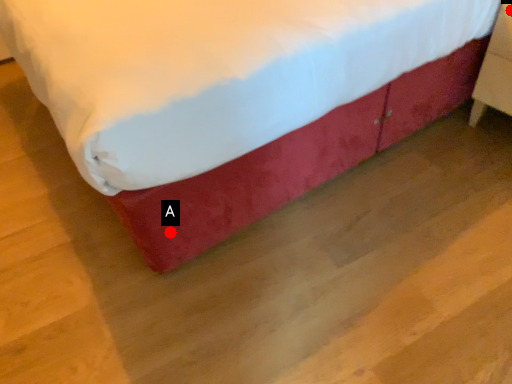
Question: Two points are circled on the image, labeled by A and B beside each circle. Which point is closer to the camera?

Choices:
 (A) A is closer
 (B) B is closer

Answer: (A)